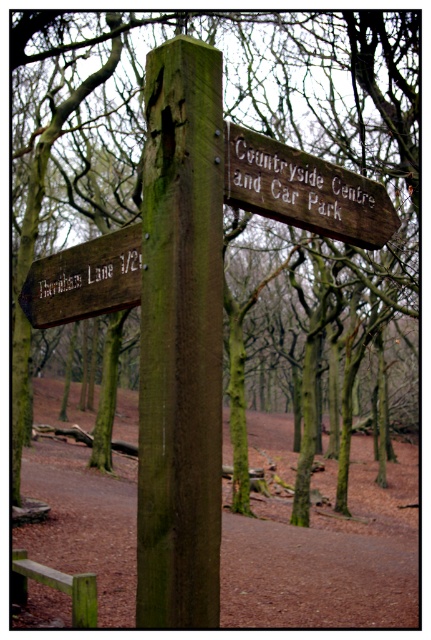
Consider the image. You are a hiker trying to determine the best path to take. You see the wooden sign at upper center and the dark brown wood signpost at left. Which sign is taller?

The wooden sign at upper center is taller than the dark brown wood signpost at left.

You are a hiker trying to find the Countryside Centre and Car Park. You see the green rough wood post at center and the dark brown wood signpost at left. Which signpost is closer to the left side of your view?

The dark brown wood signpost at left is closer to the left side of your view because the green rough wood post at center is positioned on the right side of it.

You are standing at the wooden signpost in the forest. There are two points marked on the ground near the signpost. The first point is at coordinates point (65, 262) and the second is at point (71, 616). If you want to walk towards the direction where the first point is closer to you, which direction should you walk relative to the second point?

Since point (65, 262) is in front of point (71, 616), you should walk towards the direction of the first point, which is closer to you compared to the second point.